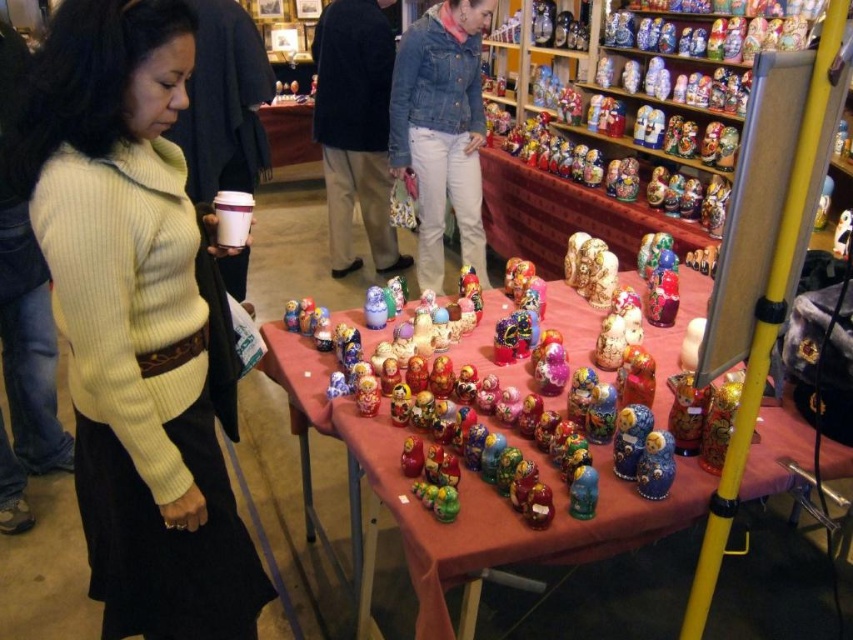
You are standing in front of the table with nesting dolls. You see a point labeled as point (x=134, y=321). What object is located at that point?

The point (x=134, y=321) indicates the ribbed knit sweater at left.

You are standing at the market and see the point marked at coordinates (473, 493). What object is this point located on?

The point marked at coordinates (473, 493) is located on the multicolored painted dolls at center.

In the scene shown: You are a vendor at the market and want to show a customer the shiny blue doll at center. However, the ribbed knit sweater at left is blocking the view. Can you move the sweater to reveal the doll?

The ribbed knit sweater at left is positioned over the shiny blue doll at center, so moving the sweater would allow the doll to be seen.